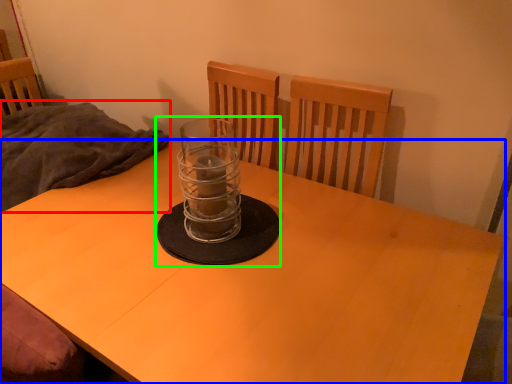
Question: Considering the real-world distances, which object is closest to blanket (highlighted by a red box)? desk (highlighted by a blue box) or candle holder (highlighted by a green box).

Choices:
 (A) desk
 (B) candle holder

Answer: (A)